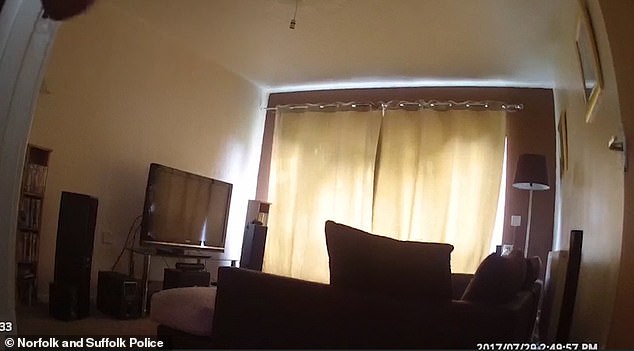
Where is `dark gray tv screen`? The height and width of the screenshot is (351, 634). dark gray tv screen is located at coordinates (174, 203).